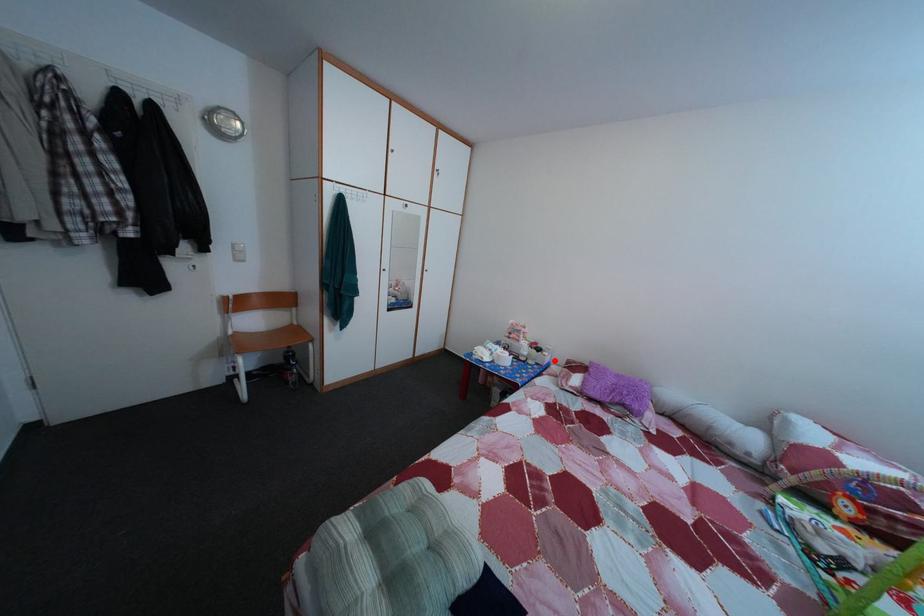
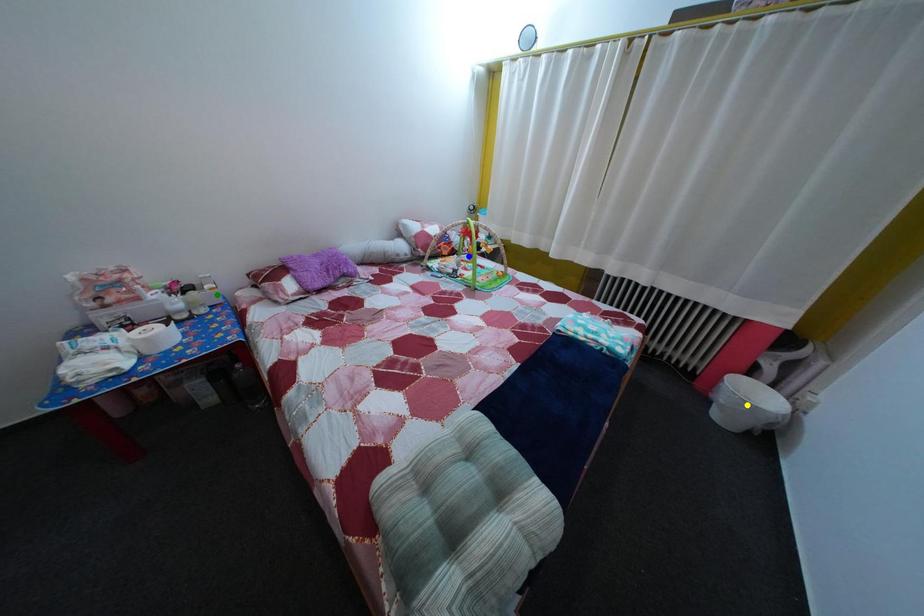
Question: I am providing you with two images of the same scene from different viewpoints. A red point is marked on the first image. You are given multiple points on the second image. Which point in image 2 represents the same 3d spot as the red point in image 1?

Choices:
 (A) blue point
 (B) yellow point
 (C) green point

Answer: (C)